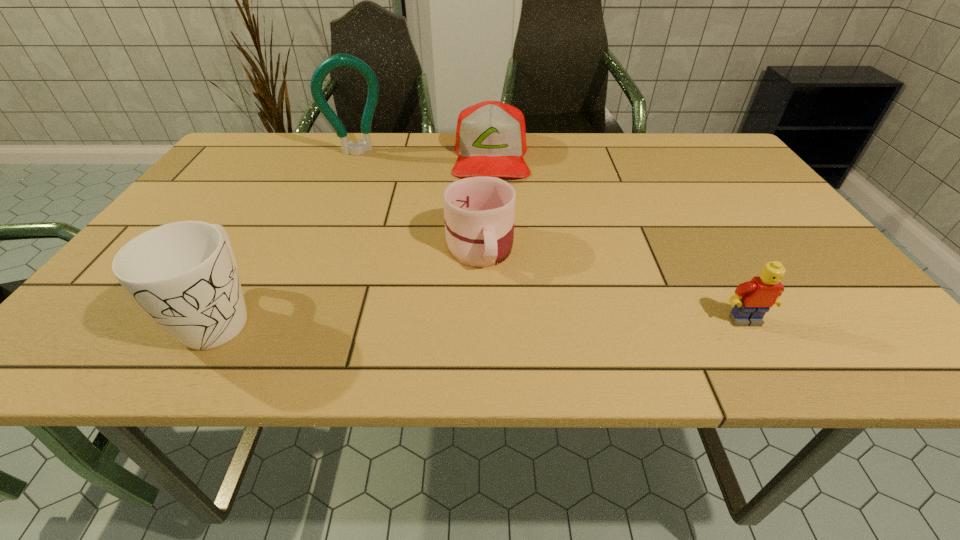
Where is `vacant space located 0.110m on the front-facing side of the baseball cap`? Image resolution: width=960 pixels, height=540 pixels. vacant space located 0.110m on the front-facing side of the baseball cap is located at coordinates (492, 208).

Find the location of a particular element. The width and height of the screenshot is (960, 540). blank space located at the jaws of the bottle opener is located at coordinates (372, 175).

Find the location of a particular element. The width and height of the screenshot is (960, 540). vacant position located 0.070m at the jaws of the bottle opener is located at coordinates (370, 170).

At what (x,y) coordinates should I click in order to perform the action: click on vacant space located at the jaws of the bottle opener. Please return your answer as a coordinate pair (x, y). Looking at the image, I should click on pyautogui.click(x=376, y=186).

Where is `baseball cap situated at the far edge`? baseball cap situated at the far edge is located at coordinates coord(491,136).

Find the location of `bottle opener present at the far edge`. bottle opener present at the far edge is located at coordinates (339, 60).

You are a GUI agent. You are given a task and a screenshot of the screen. Output one action in this format:
    pyautogui.click(x=<x>, y=<y>)
    Task: Click on the mug at the near edge
    The image size is (960, 540).
    Given the screenshot: What is the action you would take?
    pyautogui.click(x=184, y=275)

Where is `Lego located in the near edge section of the desktop`? The height and width of the screenshot is (540, 960). Lego located in the near edge section of the desktop is located at coordinates (752, 299).

Identify the location of vacant position at the far edge of the desktop. (371, 172).

This screenshot has width=960, height=540. Find the location of `vacant space at the left edge`. vacant space at the left edge is located at coordinates [x=199, y=195].